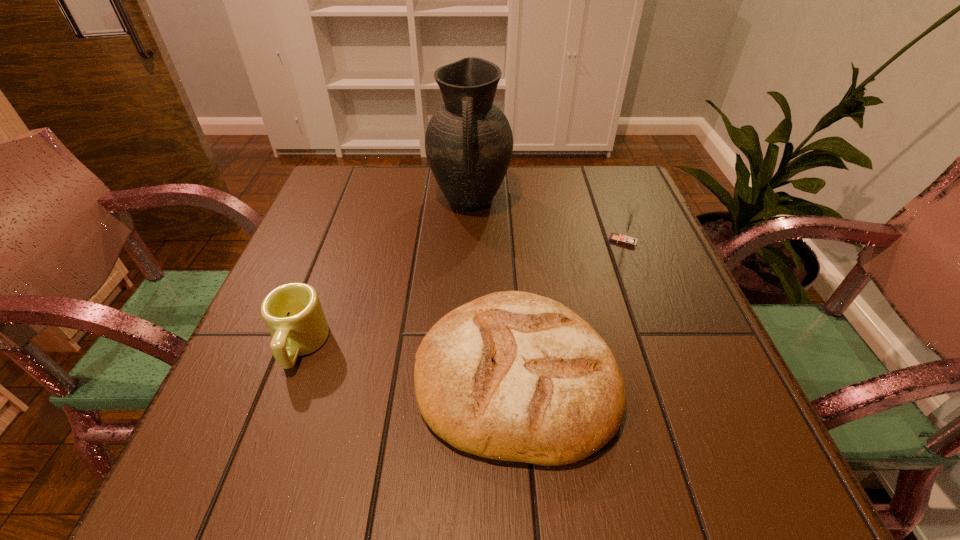
This screenshot has width=960, height=540. Find the location of `vacant space in between the matchbox and the farthest object`. vacant space in between the matchbox and the farthest object is located at coordinates (546, 221).

Identify which object is located as the third nearest to the tallest object. Please provide its 2D coordinates. Your answer should be formatted as a tuple, i.e. [(x, y)], where the tuple contains the x and y coordinates of a point satisfying the conditions above.

[(293, 314)]

This screenshot has width=960, height=540. I want to click on object that is the second closest to the leftmost object, so click(x=468, y=142).

You are a GUI agent. You are given a task and a screenshot of the screen. Output one action in this format:
    pyautogui.click(x=<x>, y=<y>)
    Task: Click on the vacant space that satisfies the following two spatial constraints: 1. on the side of the farthest object with the handle; 2. on the left side of the bread
    This screenshot has height=540, width=960.
    Given the screenshot: What is the action you would take?
    pyautogui.click(x=465, y=376)

Identify the location of vacant region that satisfies the following two spatial constraints: 1. with the handle on the side of the bread; 2. on the right side of the leftmost object. The width and height of the screenshot is (960, 540). (289, 376).

Where is `free space that satisfies the following two spatial constraints: 1. with the handle on the side of the bread; 2. on the left side of the mug`? The width and height of the screenshot is (960, 540). free space that satisfies the following two spatial constraints: 1. with the handle on the side of the bread; 2. on the left side of the mug is located at coordinates (289, 376).

Locate an element on the screen. The image size is (960, 540). free space that satisfies the following two spatial constraints: 1. with the handle on the side of the leftmost object; 2. on the right side of the bread is located at coordinates (289, 376).